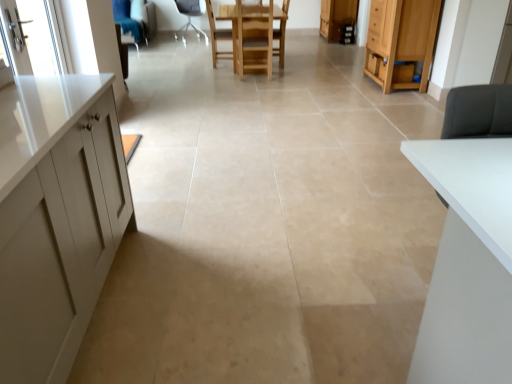
Locate an element on the screen. wooden cabinet at upper right, acting as the first cabinetry starting from the back is located at coordinates (336, 17).

What do you see at coordinates (400, 41) in the screenshot?
I see `wooden cabinet at right, the first cabinetry when ordered from bottom to top` at bounding box center [400, 41].

Measure the distance between point (286, 8) and camera.

The depth of point (286, 8) is 6.30 meters.

In order to face clear glass screen door at upper left, should I rotate leftwards or rightwards?

You should look left and rotate roughly 26.355 degrees.

Describe the element at coordinates (254, 38) in the screenshot. The image size is (512, 384). I see `wooden chair at center, the first chair in the front-to-back sequence` at that location.

Find the location of a particular element. The height and width of the screenshot is (384, 512). wooden cabinet at upper right, acting as the first cabinetry starting from the back is located at coordinates (x=336, y=17).

Can you tell me how much wooden chair at center, the first chair in the front-to-back sequence, and clear glass screen door at upper left differ in facing direction?

90.8 degrees separate the facing orientations of wooden chair at center, the first chair in the front-to-back sequence, and clear glass screen door at upper left.

Looking at this image, is wooden chair at center, marked as the 3th chair in a left-to-right arrangement, positioned in front of clear glass screen door at upper left?

No, it is not.

Does point (243, 33) appear closer or farther from the camera than point (49, 55)?

Point (243, 33).

Choose the correct answer: Is wooden chair at center, the first chair viewed from the right, inside clear glass screen door at upper left or outside it?

wooden chair at center, the first chair viewed from the right, is located beyond the bounds of clear glass screen door at upper left.

Which of these two, wooden cabinet at right, the second cabinetry when ordered from back to front, or wooden chair at center, which ranks as the 2th chair in right-to-left order, stands taller?

wooden cabinet at right, the second cabinetry when ordered from back to front.

Between wooden cabinet at right, the first cabinetry when ordered from bottom to top, and wooden chair at center, the 2th chair when ordered from left to right, which one appears on the left side from the viewer's perspective?

wooden chair at center, the 2th chair when ordered from left to right, is more to the left.

Is wooden cabinet at right, the first cabinetry when ordered from bottom to top, aimed at wooden chair at center, which appears as the second chair when viewed from the front?

No, wooden cabinet at right, the first cabinetry when ordered from bottom to top, does not turn towards wooden chair at center, which appears as the second chair when viewed from the front.

Is wooden cabinet at right, the first cabinetry when ordered from bottom to top, in contact with wooden chair at center, which appears as the second chair when viewed from the front?

wooden cabinet at right, the first cabinetry when ordered from bottom to top, and wooden chair at center, which appears as the second chair when viewed from the front, are clearly separated.

Is wooden cabinet at right, the first cabinetry when ordered from bottom to top, with white fabric chair at center, the first chair from the back?

There is a gap between wooden cabinet at right, the first cabinetry when ordered from bottom to top, and white fabric chair at center, the first chair from the back.

Considering the sizes of objects wooden cabinet at right, positioned as the 1th cabinetry in front-to-back order, and white fabric chair at center, which is counted as the 3th chair, starting from the right, in the image provided, who is thinner, wooden cabinet at right, positioned as the 1th cabinetry in front-to-back order, or white fabric chair at center, which is counted as the 3th chair, starting from the right,?

wooden cabinet at right, positioned as the 1th cabinetry in front-to-back order, is thinner.

From the image's perspective, is wooden cabinet at right, the first cabinetry when ordered from bottom to top, located above or below white fabric chair at center, which is counted as the 3th chair, starting from the right?

From the image's perspective, wooden cabinet at right, the first cabinetry when ordered from bottom to top, appears below white fabric chair at center, which is counted as the 3th chair, starting from the right.

From a real-world perspective, which is physically below, wooden cabinet at right, which is the second cabinetry from top to bottom, or white fabric chair at center, the first chair from the back?

In real-world perspective, white fabric chair at center, the first chair from the back, is lower.

Which object is further away from the camera, wooden chair at center or wooden cabinet at right, the second cabinetry when ordered from back to front?

wooden chair at center is further from the camera.

Is wooden chair at center situated inside wooden cabinet at right, which is the second cabinetry from top to bottom, or outside?

wooden chair at center is not enclosed by wooden cabinet at right, which is the second cabinetry from top to bottom.

Considering the relative sizes of wooden chair at center and wooden cabinet at right, positioned as the 1th cabinetry in front-to-back order, in the image provided, is wooden chair at center taller than wooden cabinet at right, positioned as the 1th cabinetry in front-to-back order,?

No.

Does wooden chair at center appear on the left side of wooden cabinet at right, positioned as the 1th cabinetry in front-to-back order?

Yes.

Is wooden chair at center, which appears as the second chair when viewed from the front, not inside wooden chair at center?

wooden chair at center, which appears as the second chair when viewed from the front, lies outside wooden chair at center's area.

Is wooden chair at center, the 2th chair in the back-to-front sequence, positioned before wooden chair at center?

Yes, wooden chair at center, the 2th chair in the back-to-front sequence, is closer to the viewer.

Consider the image. Is wooden chair at center, the 2th chair in the back-to-front sequence, next to wooden chair at center?

No, wooden chair at center, the 2th chair in the back-to-front sequence, is not with wooden chair at center.

From the image's perspective, which one is positioned higher, wooden chair at center, which appears as the second chair when viewed from the front, or wooden chair at center?

wooden chair at center is shown above in the image.

From a real-world perspective, between wooden cabinet at upper right, positioned as the second cabinetry in bottom-to-top order, and white fabric chair at center, the first chair positioned from the left, who is vertically higher?

From a 3D spatial view, white fabric chair at center, the first chair positioned from the left, is above.

How far apart are wooden cabinet at upper right, acting as the 1th cabinetry starting from the top, and white fabric chair at center, which is counted as the 3th chair, starting from the right?

The distance of wooden cabinet at upper right, acting as the 1th cabinetry starting from the top, from white fabric chair at center, which is counted as the 3th chair, starting from the right, is 2.54 meters.

Between wooden cabinet at upper right, the 2th cabinetry positioned from the front, and white fabric chair at center, the first chair positioned from the left, which one has less height?

Standing shorter between the two is wooden cabinet at upper right, the 2th cabinetry positioned from the front.

Could you tell me if wooden cabinet at upper right, acting as the 1th cabinetry starting from the top, is facing white fabric chair at center, the first chair positioned from the left?

Yes, wooden cabinet at upper right, acting as the 1th cabinetry starting from the top, faces towards white fabric chair at center, the first chair positioned from the left.

Between wooden chair at center, the first chair in the front-to-back sequence, and wooden chair at center, which one is positioned in front?

wooden chair at center, the first chair in the front-to-back sequence, is closer to the camera.

From the picture: Is wooden chair at center, the first chair viewed from the right, to the left or to the right of wooden chair at center in the image?

wooden chair at center, the first chair viewed from the right, is positioned on wooden chair at center's left side.

Based on the photo, could you tell me if wooden chair at center, the first chair in the front-to-back sequence, is facing wooden chair at center?

Yes, wooden chair at center, the first chair in the front-to-back sequence, is aimed at wooden chair at center.

Which of these two, wooden chair at center, the first chair in the front-to-back sequence, or wooden chair at center, is wider?

wooden chair at center, the first chair in the front-to-back sequence, is wider.

The width and height of the screenshot is (512, 384). Find the location of `screen door that appears on the left of wooden chair at center, the first chair in the front-to-back sequence`. screen door that appears on the left of wooden chair at center, the first chair in the front-to-back sequence is located at coordinates (35, 36).

Identify the location of the 2nd chair above the wooden cabinet at right, positioned as the 1th cabinetry in front-to-back order (from the image's perspective). The width and height of the screenshot is (512, 384). (217, 37).

Which object lies further to the anchor point wooden cabinet at upper right, acting as the first cabinetry starting from the back, clear glass screen door at upper left or wooden chair at center?

The object further to wooden cabinet at upper right, acting as the first cabinetry starting from the back, is clear glass screen door at upper left.

Estimate the real-world distances between objects in this image. Which object is closer to clear glass screen door at upper left, white fabric chair at center, the first chair from the back, or wooden chair at center, which ranks as the 2th chair in right-to-left order?

wooden chair at center, which ranks as the 2th chair in right-to-left order, is positioned closer to the anchor clear glass screen door at upper left.

From the image, which object appears to be farther from wooden cabinet at right, positioned as the 1th cabinetry in front-to-back order, wooden chair at center or white fabric chair at center, which is counted as the 3th chair, starting from the right?

white fabric chair at center, which is counted as the 3th chair, starting from the right.

Estimate the real-world distances between objects in this image. Which object is closer to white fabric chair at center, the first chair positioned from the left, wooden cabinet at upper right, the 2th cabinetry positioned from the front, or wooden chair at center?

wooden cabinet at upper right, the 2th cabinetry positioned from the front, is closer to white fabric chair at center, the first chair positioned from the left.

Considering their positions, is white fabric chair at center, the first chair positioned from the left, positioned further to wooden cabinet at right, the second cabinetry when ordered from back to front, than wooden cabinet at upper right, the 2th cabinetry positioned from the front?

The object further to wooden cabinet at right, the second cabinetry when ordered from back to front, is white fabric chair at center, the first chair positioned from the left.

From the image, which object appears to be farther from clear glass screen door at upper left, wooden cabinet at upper right, acting as the first cabinetry starting from the back, or white fabric chair at center, the first chair positioned from the left?

wooden cabinet at upper right, acting as the first cabinetry starting from the back.

Looking at the image, which one is located closer to wooden cabinet at upper right, acting as the 1th cabinetry starting from the top, wooden chair at center, the first chair in the front-to-back sequence, or clear glass screen door at upper left?

Among the two, wooden chair at center, the first chair in the front-to-back sequence, is located nearer to wooden cabinet at upper right, acting as the 1th cabinetry starting from the top.

Looking at the image, which one is located further to wooden chair at center, which ranks as the 2th chair in right-to-left order, wooden cabinet at right, which is the second cabinetry from top to bottom, or wooden chair at center, marked as the 3th chair in a left-to-right arrangement?

wooden cabinet at right, which is the second cabinetry from top to bottom, is further to wooden chair at center, which ranks as the 2th chair in right-to-left order.

In order to click on chair between wooden chair at center, the 2th chair in the back-to-front sequence, and wooden cabinet at right, the second cabinetry when ordered from back to front in this screenshot , I will do `click(254, 38)`.

Locate an element on the screen. armchair between wooden chair at center, the first chair in the front-to-back sequence, and wooden cabinet at upper right, the 2th cabinetry positioned from the front, along the z-axis is located at coordinates (281, 33).

At what (x,y) coordinates should I click in order to perform the action: click on armchair between wooden chair at center, which appears as the second chair when viewed from the front, and wooden cabinet at right, the second cabinetry when ordered from back to front, in the horizontal direction. Please return your answer as a coordinate pair (x, y). Image resolution: width=512 pixels, height=384 pixels. Looking at the image, I should click on (281, 33).

The width and height of the screenshot is (512, 384). I want to click on armchair located between clear glass screen door at upper left and wooden cabinet at right, the second cabinetry when ordered from back to front, in the left-right direction, so click(x=281, y=33).